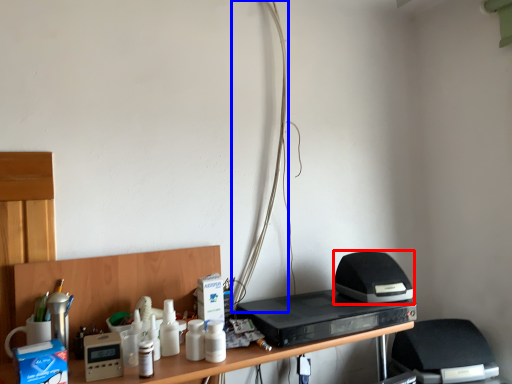
Question: Among these objects, which one is nearest to the camera, appliance (highlighted by a red box) or wire (highlighted by a blue box)?

Choices:
 (A) appliance
 (B) wire

Answer: (A)